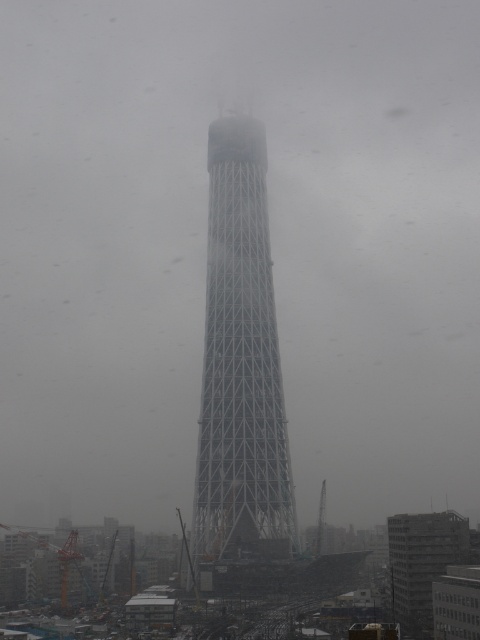
Is metallic lattice tower at center smaller than white metallic tower at center?

No, metallic lattice tower at center is not smaller than white metallic tower at center.

Measure the distance between metallic lattice tower at center and white metallic tower at center.

metallic lattice tower at center and white metallic tower at center are 40.58 meters apart from each other.

Between point (216, 440) and point (420, 531), which one is positioned in front?

Point (420, 531) is more forward.

You are a GUI agent. You are given a task and a screenshot of the screen. Output one action in this format:
    pyautogui.click(x=<x>, y=<y>)
    Task: Click on the metallic lattice tower at center
    Image resolution: width=480 pixels, height=640 pixels.
    Given the screenshot: What is the action you would take?
    pyautogui.click(x=240, y=364)